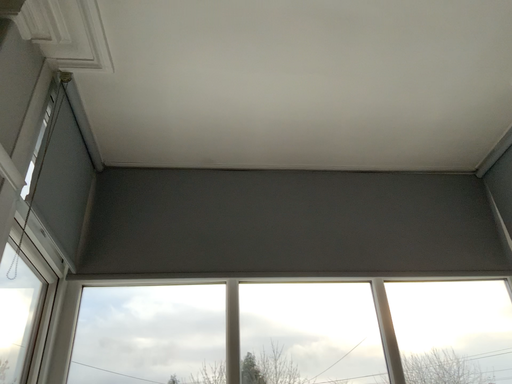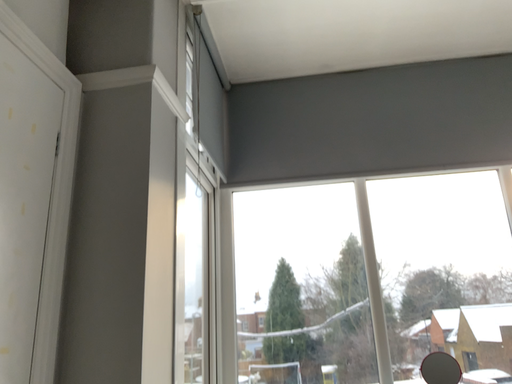
Question: Which way did the camera rotate in the video?

Choices:
 (A) rotated downward
 (B) rotated upward

Answer: (A)